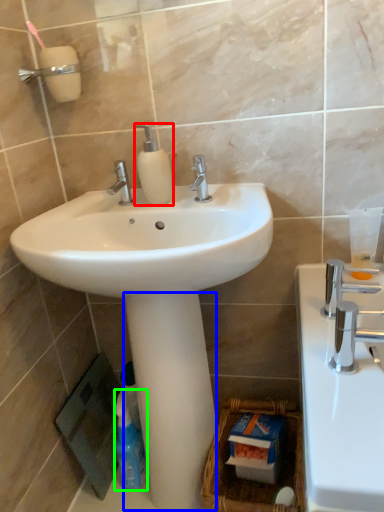
Question: Which is farther away from soap dispenser (highlighted by a red box)? pillar (highlighted by a blue box) or cleaning product (highlighted by a green box)?

Choices:
 (A) pillar
 (B) cleaning product

Answer: (B)